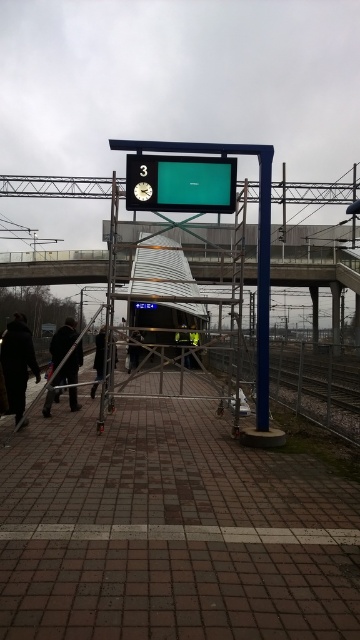
Question: Can you confirm if dark brown leather jacket at lower left is positioned to the right of dark gray uniform at center?

Choices:
 (A) no
 (B) yes

Answer: (A)

Question: Does dark brown leather jacket at lower left lie in front of dark gray uniform at center?

Choices:
 (A) yes
 (B) no

Answer: (B)

Question: Which of the following is the closest to the observer?

Choices:
 (A) (101, 333)
 (B) (142, 186)
 (C) (16, 403)

Answer: (B)

Question: Is black fabric jacket at center smaller than reflective silver helmet at center?

Choices:
 (A) no
 (B) yes

Answer: (A)

Question: Which point appears closest to the camera in this image?

Choices:
 (A) (183, 337)
 (B) (96, 348)
 (C) (146, 188)
 (D) (137, 339)

Answer: (C)

Question: Which of the following is the farthest from the observer?

Choices:
 (A) dark gray uniform at center
 (B) dark brown leather coat at lower left
 (C) reflective silver helmet at center

Answer: (C)